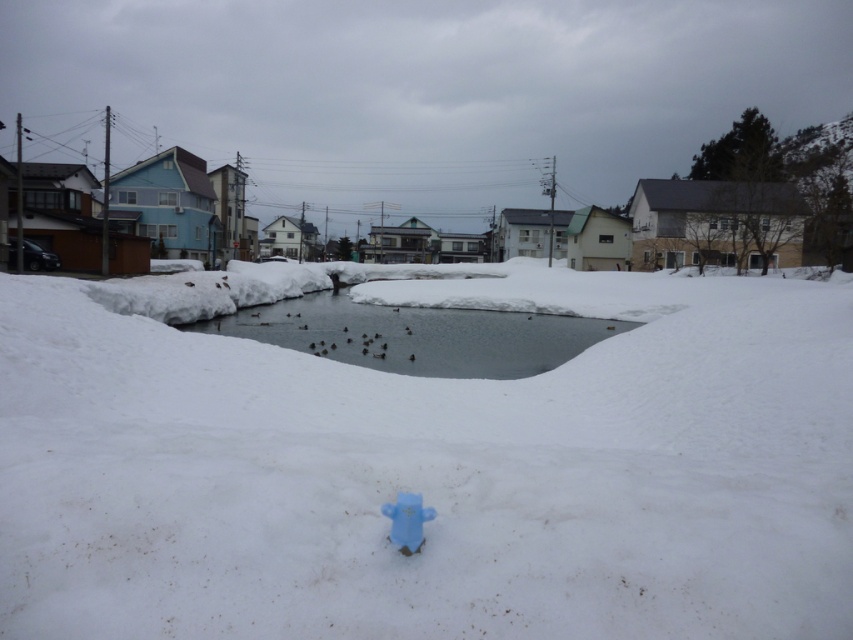
Question: Among these objects, which one is farthest from the camera?

Choices:
 (A) blue plastic hydrant at center
 (B) white fluffy snow at center
 (C) clear ice water at center

Answer: (C)

Question: Does white fluffy snow at center appear over clear ice water at center?

Choices:
 (A) yes
 (B) no

Answer: (A)

Question: Is white fluffy snow at center wider than clear ice water at center?

Choices:
 (A) no
 (B) yes

Answer: (B)

Question: Which object appears closest to the camera in this image?

Choices:
 (A) white fluffy snow at center
 (B) clear ice water at center

Answer: (A)

Question: Does white fluffy snow at center have a smaller size compared to blue plastic hydrant at center?

Choices:
 (A) yes
 (B) no

Answer: (B)

Question: Estimate the real-world distances between objects in this image. Which object is closer to the white fluffy snow at center?

Choices:
 (A) clear ice water at center
 (B) blue plastic hydrant at center

Answer: (A)